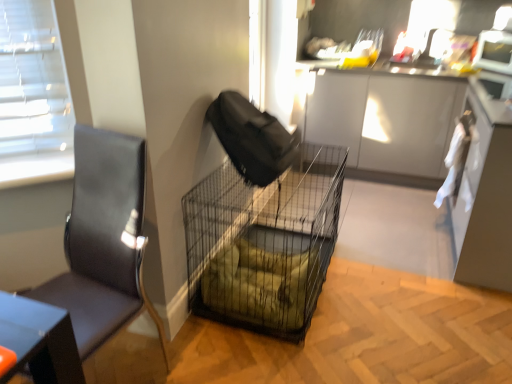
This screenshot has width=512, height=384. What do you see at coordinates (265, 242) in the screenshot?
I see `black wire mesh cage at center` at bounding box center [265, 242].

Image resolution: width=512 pixels, height=384 pixels. Describe the element at coordinates (469, 169) in the screenshot. I see `white cloth at right` at that location.

In order to click on black wire mesh cage at center in this screenshot , I will do `click(265, 242)`.

Can you confirm if white glossy microwave at upper right is smaller than black wire mesh cage at center?

Yes.

Is white glossy microwave at upper right beside black wire mesh cage at center?

No, white glossy microwave at upper right is not in contact with black wire mesh cage at center.

Which of these two, white glossy microwave at upper right or black wire mesh cage at center, is wider?

black wire mesh cage at center.

Is metal mesh crate at center to the right of black wire mesh cage at center from the viewer's perspective?

Yes.

In the image, is metal mesh crate at center positioned in front of or behind black wire mesh cage at center?

metal mesh crate at center is positioned farther from the viewer than black wire mesh cage at center.

Does point (367, 86) come farther from viewer compared to point (303, 188)?

No.

Which of these two, white cloth at right or black wire mesh cage at center, is wider?

Wider between the two is black wire mesh cage at center.

Measure the distance from white cloth at right to black wire mesh cage at center.

white cloth at right is 97.92 centimeters from black wire mesh cage at center.

Are white cloth at right and black wire mesh cage at center making contact?

white cloth at right is not next to black wire mesh cage at center, and they're not touching.

From the picture: Is white cloth at right at the right side of black wire mesh cage at center?

Yes, white cloth at right is to the right of black wire mesh cage at center.

Considering the positions of objects black wire mesh cage at center and black leather chair at left in the image provided, who is more to the left, black wire mesh cage at center or black leather chair at left?

black leather chair at left is more to the left.

Considering the relative sizes of black wire mesh cage at center and black leather chair at left in the image provided, is black wire mesh cage at center smaller than black leather chair at left?

Actually, black wire mesh cage at center might be larger than black leather chair at left.

From a real-world perspective, who is located higher, black wire mesh cage at center or black leather chair at left?

From a 3D spatial view, black leather chair at left is above.

Locate an element on the screen. The height and width of the screenshot is (384, 512). bird cage that appears on the right of black leather chair at left is located at coordinates (265, 242).

Do you think black leather chair at left is within white cloth at right, or outside of it?

The correct answer is: outside.

From a real-world perspective, who is located higher, black leather chair at left or white cloth at right?

From a 3D spatial view, black leather chair at left is above.

Which object is more forward, black leather chair at left or white cloth at right?

Positioned in front is black leather chair at left.

Is black leather chair at left far away from white cloth at right?

black leather chair at left is positioned a significant distance from white cloth at right.

In the scene shown: Considering the relative sizes of black wire mesh cage at center and white glossy microwave at upper right in the image provided, is black wire mesh cage at center wider than white glossy microwave at upper right?

Correct, the width of black wire mesh cage at center exceeds that of white glossy microwave at upper right.

Between black wire mesh cage at center and white glossy microwave at upper right, which one is positioned behind?

white glossy microwave at upper right is behind.

Considering the sizes of objects black wire mesh cage at center and white glossy microwave at upper right in the image provided, who is taller, black wire mesh cage at center or white glossy microwave at upper right?

With more height is black wire mesh cage at center.

Considering the sizes of black wire mesh cage at center and white glossy microwave at upper right in the image, is black wire mesh cage at center bigger or smaller than white glossy microwave at upper right?

In the image, black wire mesh cage at center appears to be larger than white glossy microwave at upper right.

Which of these two, black wire mesh cage at center or metal mesh crate at center, is thinner?

Thinner between the two is black wire mesh cage at center.

Can you tell me how much black wire mesh cage at center and metal mesh crate at center differ in facing direction?

black wire mesh cage at center and metal mesh crate at center are facing 92 degrees away from each other.

Choose the correct answer: Is black wire mesh cage at center inside metal mesh crate at center or outside it?

black wire mesh cage at center cannot be found inside metal mesh crate at center.

Is black wire mesh cage at center positioned with its back to metal mesh crate at center?

No.

Identify the location of appliance that is above the black wire mesh cage at center (from a real-world perspective). (494, 51).

This screenshot has width=512, height=384. What are the coordinates of `cabinetry behind the black wire mesh cage at center` in the screenshot? It's located at (425, 150).

Looking at the image, which one is located closer to white glossy microwave at upper right, black wire mesh cage at center or white cloth at right?

white cloth at right lies closer to white glossy microwave at upper right than the other object.

Considering their positions, is black wire mesh cage at center positioned closer to metal mesh crate at center than black leather chair at left?

The object closer to metal mesh crate at center is black wire mesh cage at center.

Considering their positions, is white cloth at right positioned further to metal mesh crate at center than white glossy microwave at upper right?

Among the two, white cloth at right is located further to metal mesh crate at center.

Based on their spatial positions, is metal mesh crate at center or white cloth at right closer to black wire mesh cage at center?

white cloth at right.

When comparing their distances from black leather chair at left, does white cloth at right or metal mesh crate at center seem closer?

white cloth at right.

Considering their positions, is black leather chair at left positioned further to white glossy microwave at upper right than black wire mesh cage at center?

black leather chair at left.

Estimate the real-world distances between objects in this image. Which object is closer to white cloth at right, black leather chair at left or black wire mesh cage at center?

The object closer to white cloth at right is black wire mesh cage at center.

Based on their spatial positions, is black leather chair at left or white glossy microwave at upper right closer to black wire mesh cage at center?

Based on the image, black leather chair at left appears to be nearer to black wire mesh cage at center.

You are a GUI agent. You are given a task and a screenshot of the screen. Output one action in this format:
    pyautogui.click(x=<x>, y=<y>)
    Task: Click on the cabinetry between black leather chair at left and white glossy microwave at upper right
    The image size is (512, 384).
    Given the screenshot: What is the action you would take?
    pyautogui.click(x=425, y=150)

The width and height of the screenshot is (512, 384). In order to click on cabinetry between black wire mesh cage at center and white glossy microwave at upper right in the horizontal direction in this screenshot , I will do `click(425, 150)`.

This screenshot has width=512, height=384. In order to click on screen door situated between black leather chair at left and white glossy microwave at upper right from left to right in this screenshot , I will do `click(469, 169)`.

At what (x,y) coordinates should I click in order to perform the action: click on bird cage between black leather chair at left and metal mesh crate at center from left to right. Please return your answer as a coordinate pair (x, y). Looking at the image, I should click on (265, 242).